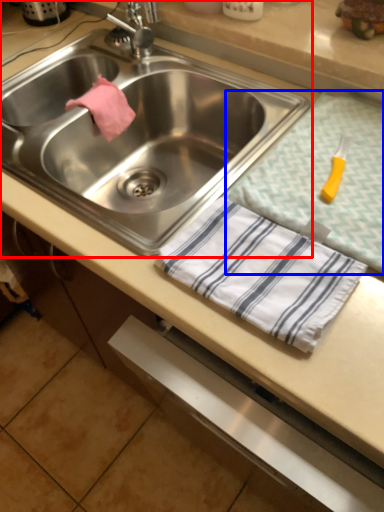
Question: Which point is closer to the camera, sink (highlighted by a red box) or tablecloth (highlighted by a blue box)?

Choices:
 (A) sink
 (B) tablecloth

Answer: (B)